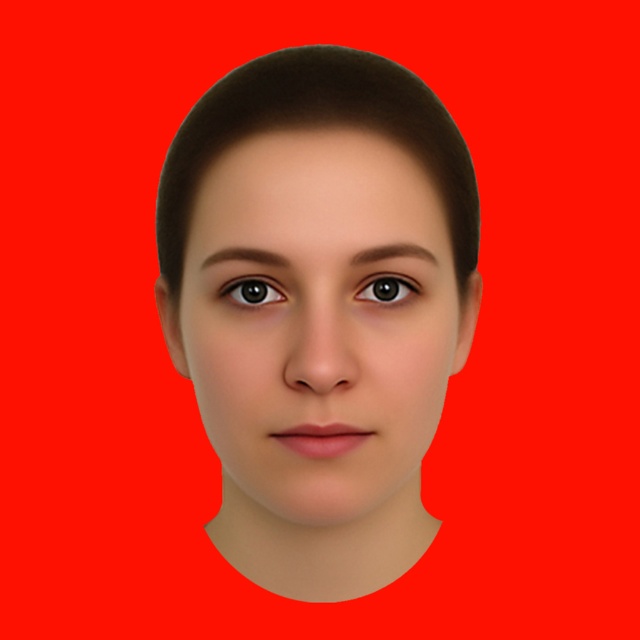
Based on the scene description, which object is positioned closer to the viewer between the smooth skin face at center and the brown glossy eye at center?

The smooth skin face at center is positioned closer to the viewer than the brown glossy eye at center according to the description.

Based on the scene description, which object is taller between the smooth skin face at center and the brown glossy eye at center?

The smooth skin face at center is taller than the brown glossy eye at center according to the description.

Based on the scene description, is the smooth skin face at center positioned to the left or right of the brown glossy eye at center?

The smooth skin face at center is to the left of the brown glossy eye at center.